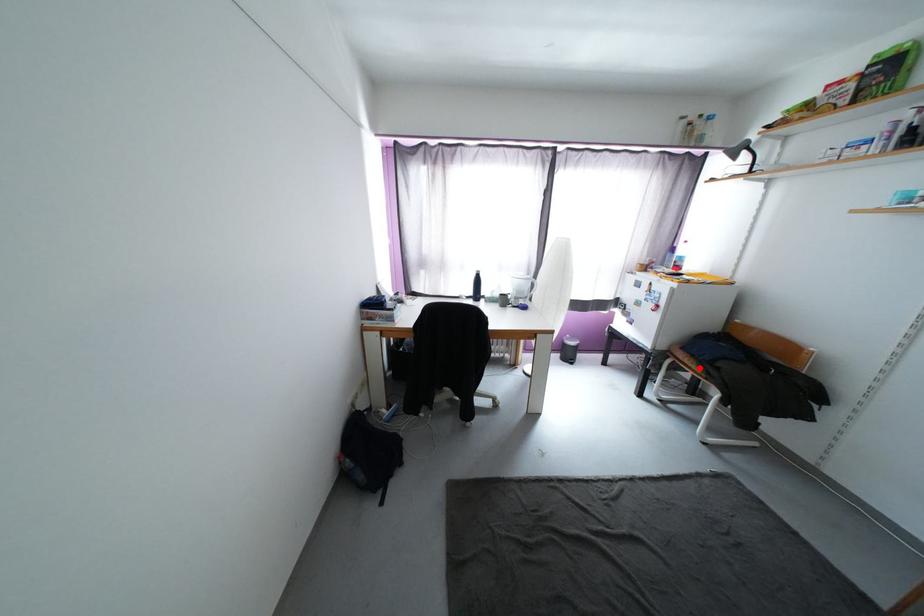
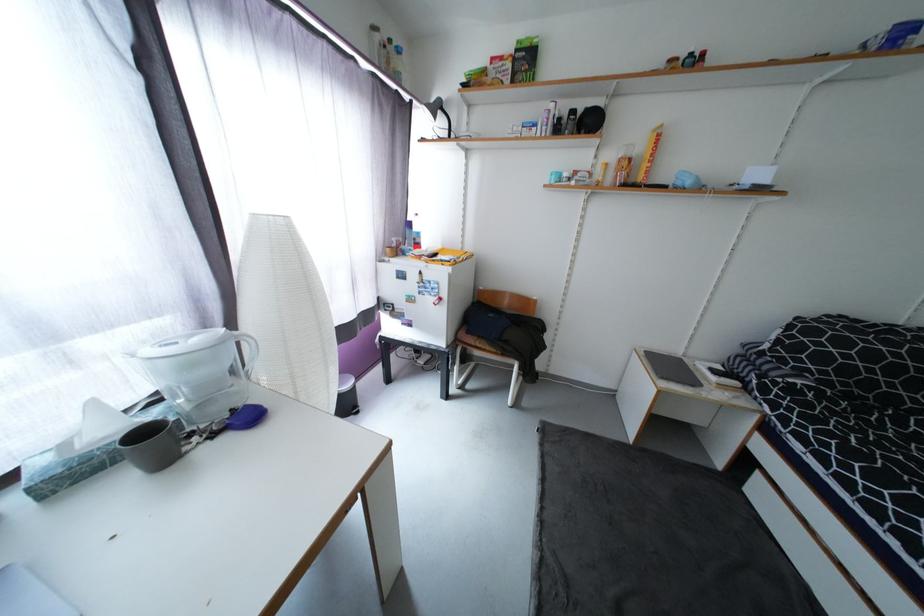
Find the pixel in the second image that matches the highlighted location in the first image.

(493, 349)